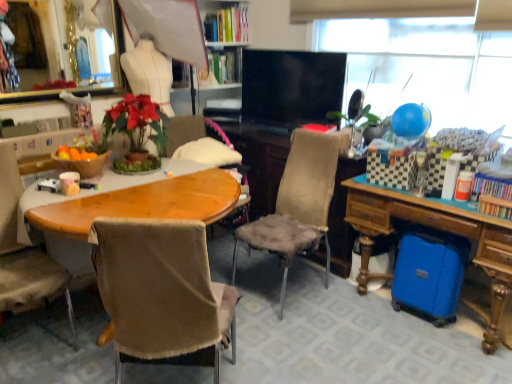
Question: Considering the positions of point (0, 198) and point (159, 296), is point (0, 198) closer or farther from the camera than point (159, 296)?

Choices:
 (A) closer
 (B) farther

Answer: (B)

Question: From a real-world perspective, is brown fabric chair at left, which ranks as the third chair in right-to-left order, above or below brown fabric chair at center, the second chair viewed from the left?

Choices:
 (A) below
 (B) above

Answer: (B)

Question: Which is nearer to the brown fabric chair at left, the first chair viewed from the left?

Choices:
 (A) brown fabric chair at center
 (B) black glossy flat-screen tv at center
 (C) brown fabric chair at center, marked as the 2th chair in a right-to-left arrangement
 (D) velvet-like beige chair at center, which ranks as the 1th chair in right-to-left order
 (E) blue glossy balloon at upper right

Answer: (C)

Question: Estimate the real-world distances between objects in this image. Which object is closer to the velvet-like beige chair at center, which ranks as the 1th chair in right-to-left order?

Choices:
 (A) wooden desk at lower right
 (B) blue matte globe at upper right
 (C) blue glossy balloon at upper right
 (D) brown fabric chair at left, the first chair viewed from the left
 (E) black glossy flat-screen tv at center

Answer: (A)